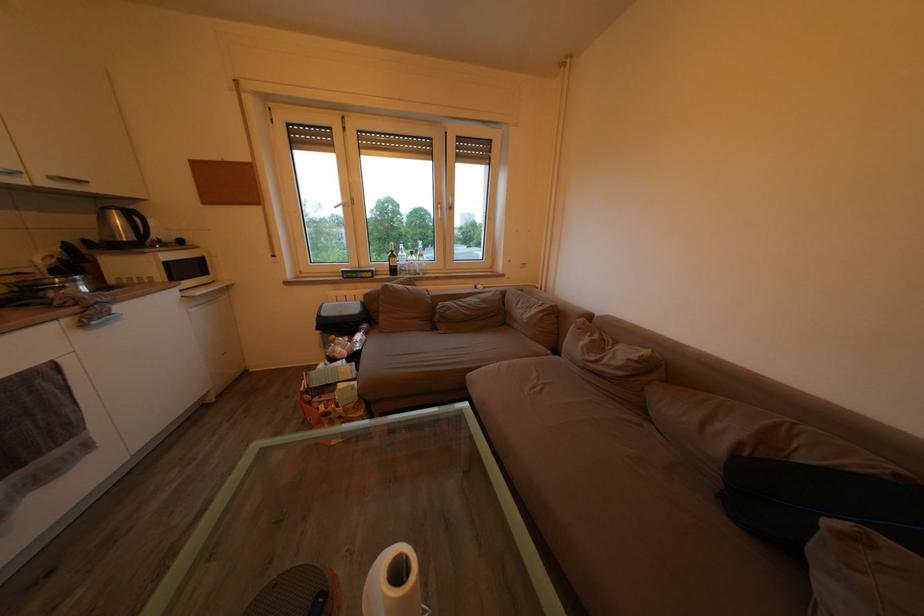
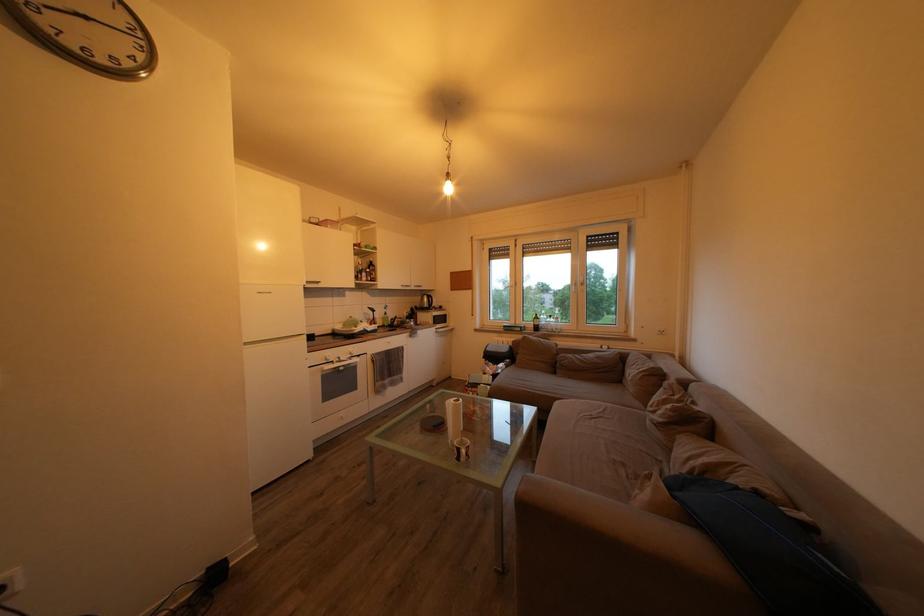
In the second image, find the point that corresponds to (44,265) in the first image.

(412, 318)